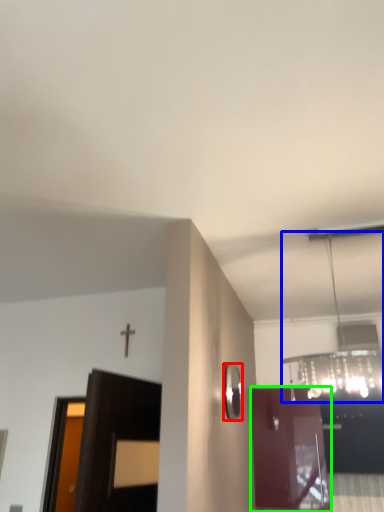
Question: Based on their relative distances, which object is nearer to mirror (highlighted by a red box)? Choose from light fixture (highlighted by a blue box) and door (highlighted by a green box).

Choices:
 (A) light fixture
 (B) door

Answer: (A)